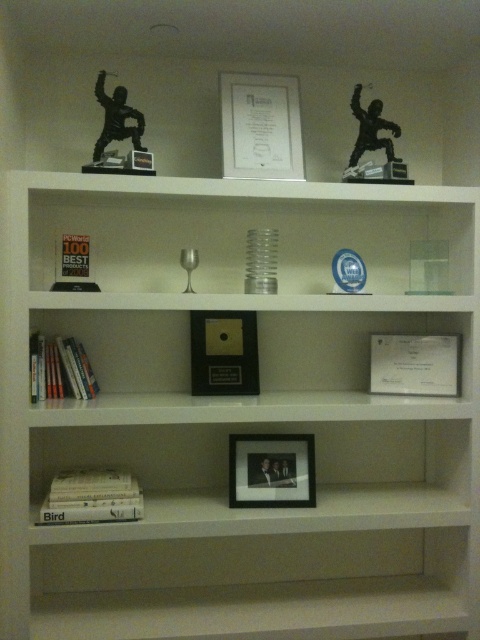
You are organizing a display in the white shelving unit and need to place a new item between the metallic gold picture frame at center and the hardcover books at lower left. Based on their positions, where should the new item be placed relative to the existing items?

The metallic gold picture frame at center is further to the viewer than the hardcover books at lower left, so the new item should be placed between them along the depth of the shelf, closer to the viewer than the hardcover books at lower left but behind the metallic gold picture frame at center.

You are organizing items on a white shelving unit and need to place a new item that requires a wider space. Which object between the white glossy bookshelf at upper center and the white matte book at lower left should you choose to place it next to?

The white glossy bookshelf at upper center has a greater width than the white matte book at lower left, so placing the new item next to the white glossy bookshelf at upper center would provide the necessary space due to its wider size.

You are organizing a display in the white shelving unit and need to place a new item exactly at the point marked by the coordinates point (239, 413). According to the image, where should you place the item?

The point (239, 413) marks the white glossy bookshelf at upper center, so you should place the new item on the white glossy bookshelf at upper center.